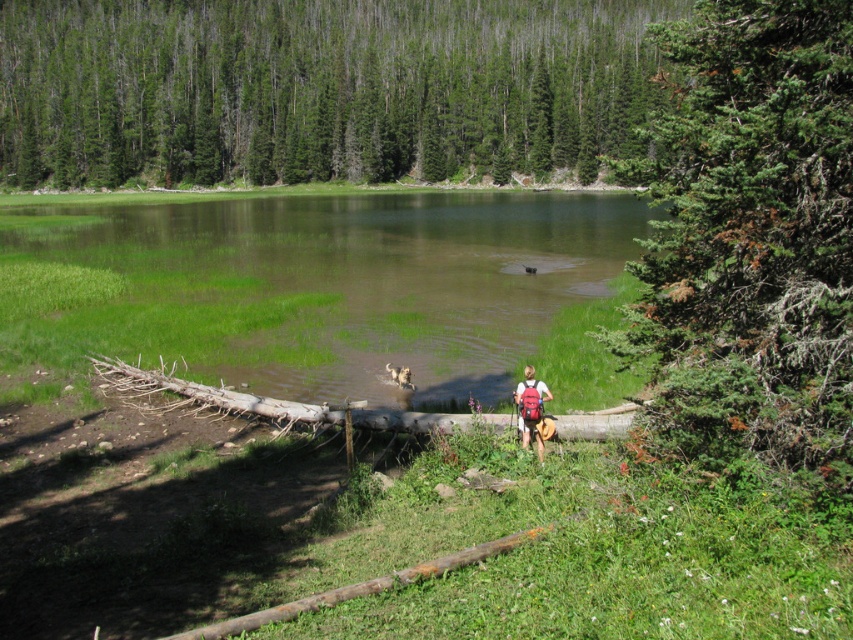
Question: Among these objects, which one is nearest to the camera?

Choices:
 (A) green grassy lake at center
 (B) green fir tree at right
 (C) golden fur dog at center
 (D) matte red backpack at center

Answer: (B)

Question: Can you confirm if matte red backpack at center is smaller than golden fur dog at center?

Choices:
 (A) yes
 (B) no

Answer: (B)

Question: Is green fir tree at right to the right of golden fur dog at center from the viewer's perspective?

Choices:
 (A) yes
 (B) no

Answer: (A)

Question: Which object is the closest to the matte red backpack at center?

Choices:
 (A) green textured forest at upper center
 (B) golden fur dog at center

Answer: (B)

Question: Is green fir tree at right behind golden fur dog at center?

Choices:
 (A) yes
 (B) no

Answer: (B)

Question: Which of the following is the closest to the observer?

Choices:
 (A) golden fur dog at center
 (B) green textured forest at upper center

Answer: (A)